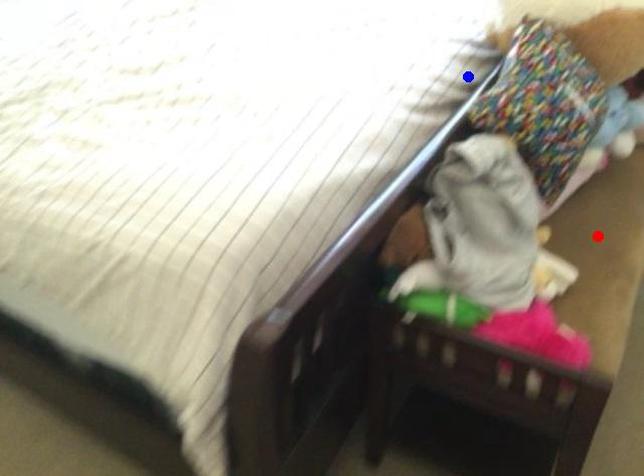
Question: Which of the two points in the image is closer to the camera?

Choices:
 (A) Blue point is closer.
 (B) Red point is closer.

Answer: (B)